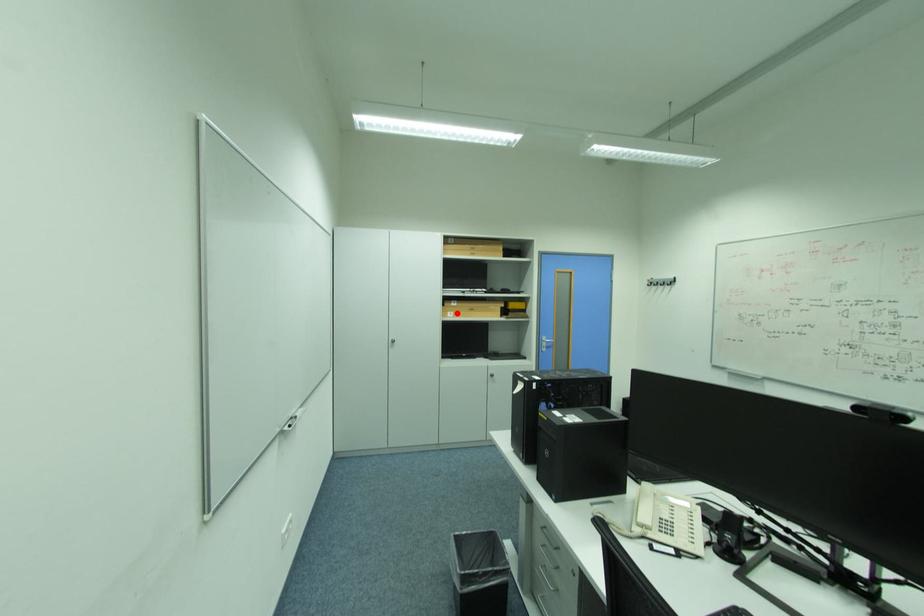
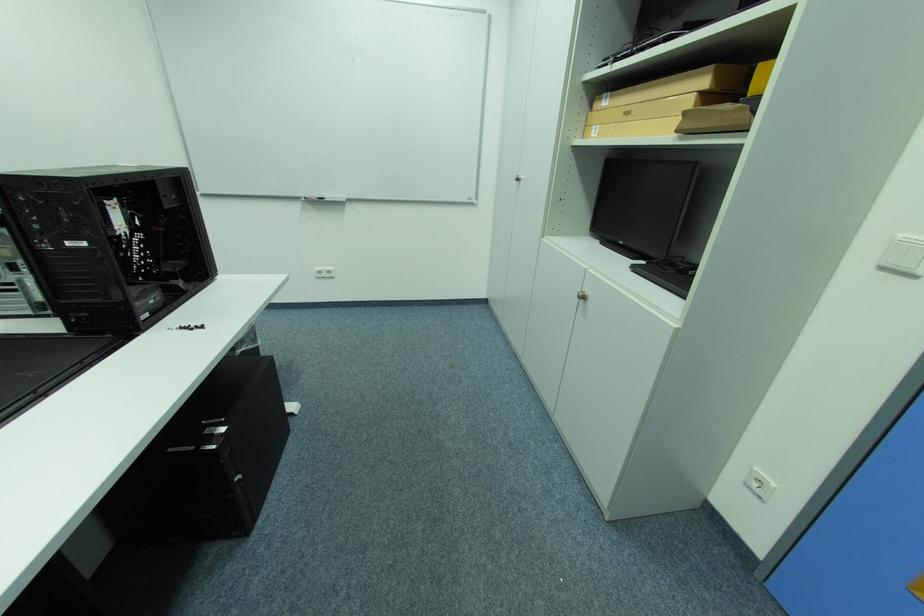
In the second image, find the point that corresponds to the highlighted location in the first image.

(602, 128)